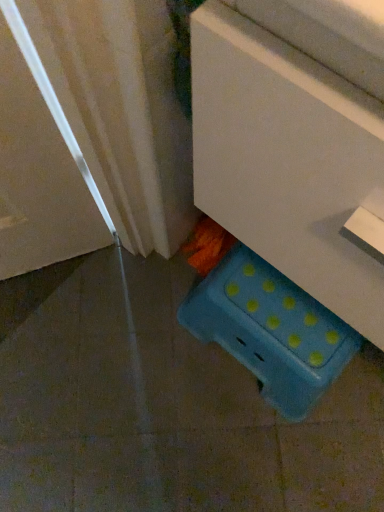
Question: Is blue polka dot plastic storage box at lower right inside or outside of blue plastic stool at lower center?

Choices:
 (A) inside
 (B) outside

Answer: (B)

Question: Is blue polka dot plastic storage box at lower right taller or shorter than blue plastic stool at lower center?

Choices:
 (A) short
 (B) tall

Answer: (A)

Question: Does point (243, 287) appear closer or farther from the camera than point (322, 183)?

Choices:
 (A) farther
 (B) closer

Answer: (A)

Question: Would you say blue plastic stool at lower center is to the left or to the right of blue polka dot plastic storage box at lower right in the picture?

Choices:
 (A) left
 (B) right

Answer: (B)

Question: Is blue plastic stool at lower center bigger or smaller than blue polka dot plastic storage box at lower right?

Choices:
 (A) small
 (B) big

Answer: (B)

Question: From the image's perspective, is blue plastic stool at lower center above or below blue polka dot plastic storage box at lower right?

Choices:
 (A) above
 (B) below

Answer: (A)

Question: Is point (317, 211) closer or farther from the camera than point (205, 334)?

Choices:
 (A) farther
 (B) closer

Answer: (B)